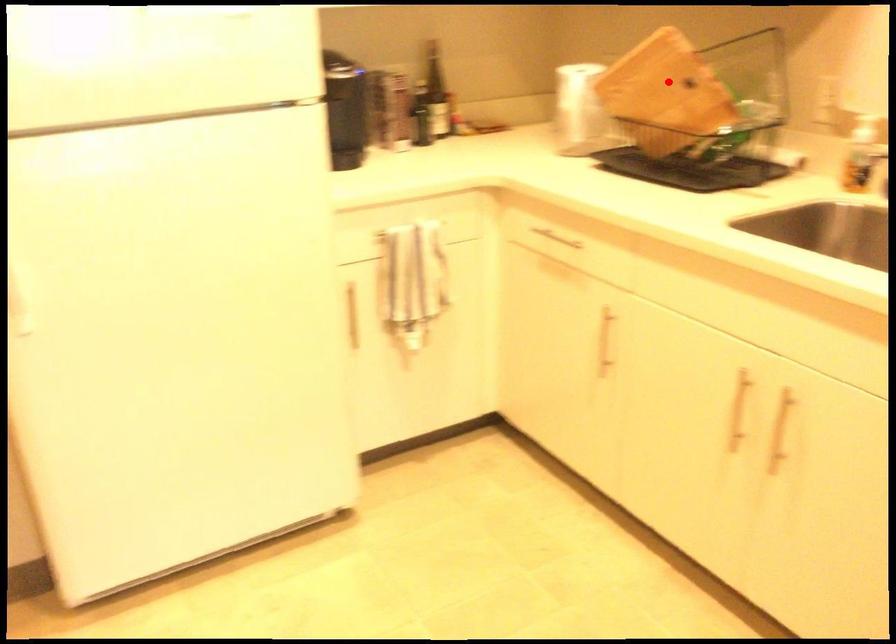
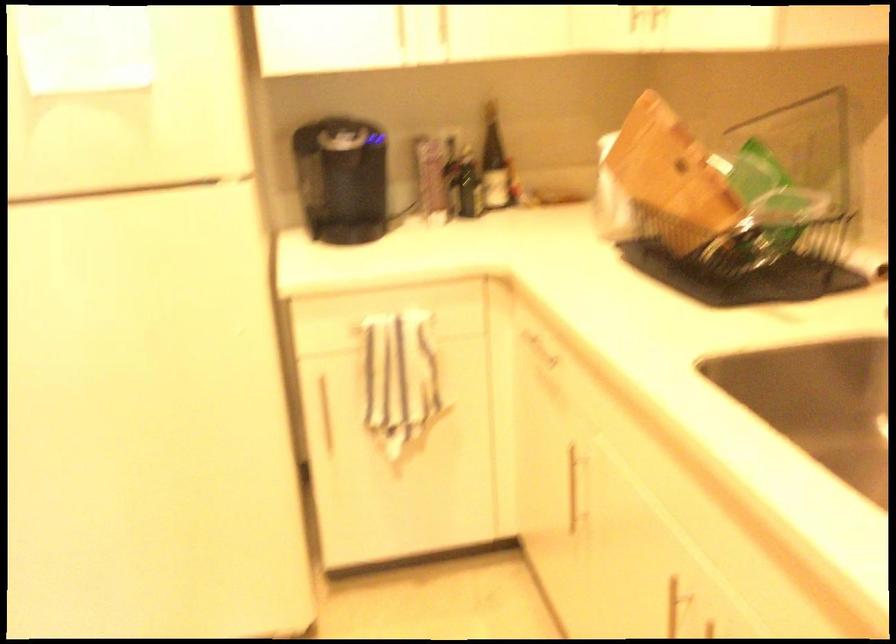
Question: I am providing you with two images of the same scene from different viewpoints. In image1, a red point is highlighted. Considering the same 3D point in image2, which of the following is correct?

Choices:
 (A) It is closer
 (B) It is farther

Answer: (A)